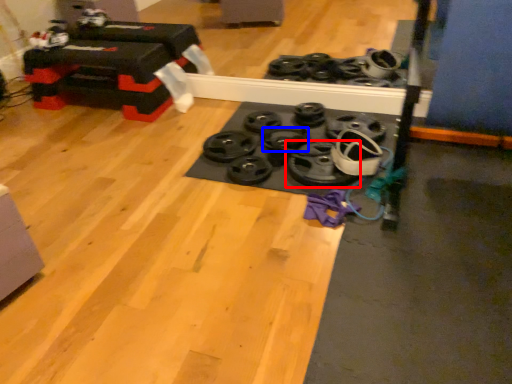
Question: Which point is closer to the camera, wheel (highlighted by a red box) or wheel (highlighted by a blue box)?

Choices:
 (A) wheel
 (B) wheel

Answer: (A)